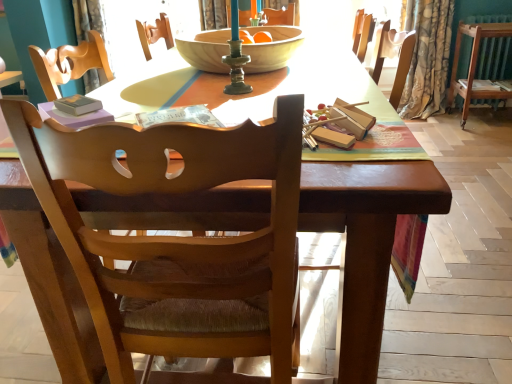
Locate an element on the screen. vacant space behind green metallic candle holder at center is located at coordinates (243, 79).